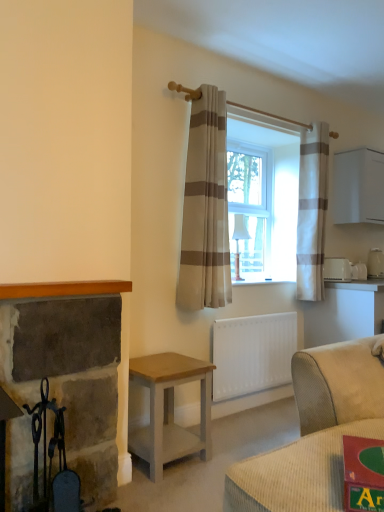
Question: Is beige striped curtain at center, the 1th curtain positioned from the front, surrounding light brown wood table at lower center?

Choices:
 (A) no
 (B) yes

Answer: (A)

Question: Is beige striped curtain at center, the 1th curtain positioned from the left, not within light brown wood table at lower center?

Choices:
 (A) yes
 (B) no

Answer: (A)

Question: Is beige striped curtain at center, positioned as the second curtain in right-to-left order, positioned far away from light brown wood table at lower center?

Choices:
 (A) yes
 (B) no

Answer: (B)

Question: Is beige striped curtain at center, the 1th curtain positioned from the left, facing away from light brown wood table at lower center?

Choices:
 (A) no
 (B) yes

Answer: (A)

Question: Does beige striped curtain at center, the 1th curtain positioned from the front, turn towards light brown wood table at lower center?

Choices:
 (A) no
 (B) yes

Answer: (A)

Question: Considering the positions of black wrought iron fireplace tools at left and white glossy toaster at upper right, marked as the second appliance in a back-to-front arrangement, in the image, is black wrought iron fireplace tools at left taller or shorter than white glossy toaster at upper right, marked as the second appliance in a back-to-front arrangement,?

Choices:
 (A) tall
 (B) short

Answer: (A)

Question: Considering the positions of black wrought iron fireplace tools at left and white glossy toaster at upper right, which is the second appliance from front to back, in the image, is black wrought iron fireplace tools at left bigger or smaller than white glossy toaster at upper right, which is the second appliance from front to back,?

Choices:
 (A) big
 (B) small

Answer: (A)

Question: From the image's perspective, is black wrought iron fireplace tools at left located above or below white glossy toaster at upper right, the second appliance viewed from the right?

Choices:
 (A) below
 (B) above

Answer: (A)

Question: In terms of width, does black wrought iron fireplace tools at left look wider or thinner when compared to white glossy toaster at upper right, acting as the second appliance starting from the left?

Choices:
 (A) wide
 (B) thin

Answer: (A)

Question: Is black wrought iron fireplace tools at left in front of or behind white plastic toaster at right, which ranks as the third appliance in back-to-front order, in the image?

Choices:
 (A) behind
 (B) front

Answer: (B)

Question: Is black wrought iron fireplace tools at left to the left or to the right of white plastic toaster at right, the third appliance positioned from the right, in the image?

Choices:
 (A) right
 (B) left

Answer: (B)

Question: Looking at their shapes, would you say black wrought iron fireplace tools at left is wider or thinner than white plastic toaster at right, which ranks as the third appliance in back-to-front order?

Choices:
 (A) wide
 (B) thin

Answer: (B)

Question: Looking at the image, does black wrought iron fireplace tools at left seem bigger or smaller compared to white plastic toaster at right, the third appliance positioned from the right?

Choices:
 (A) big
 (B) small

Answer: (A)

Question: From a real-world perspective, is beige striped curtain at center, the second curtain in the back-to-front sequence, positioned above or below white plastic toaster at right, the third appliance positioned from the right?

Choices:
 (A) above
 (B) below

Answer: (A)

Question: From the image's perspective, is beige striped curtain at center, positioned as the second curtain in right-to-left order, located above or below white plastic toaster at right, the third appliance positioned from the right?

Choices:
 (A) below
 (B) above

Answer: (B)